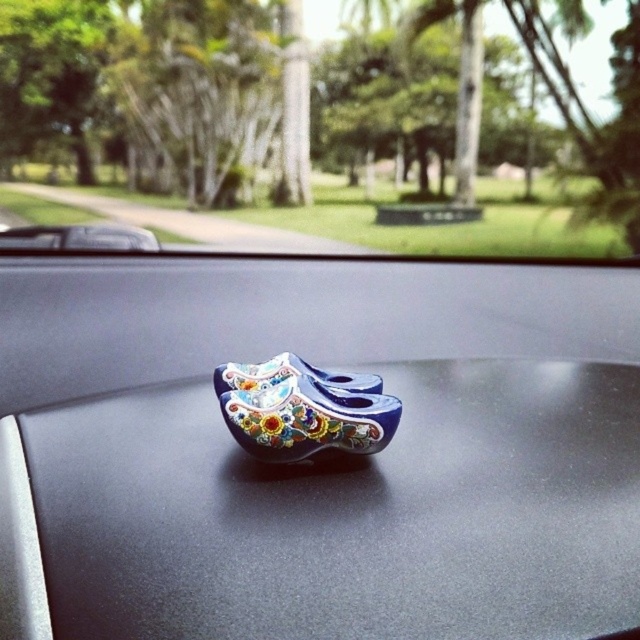
You are sitting in the driver seat of the car and see the point marked at coordinate (349, 513). Which object is that point located on?

The point marked at coordinate (349, 513) is located on the glossy ceramic clogs at center.

You are a passenger in the car and want to take a photo of the blue glossy wooden shoes at center through the transparent glass car window at center. Can you do this without moving either object?

The transparent glass car window at center is positioned on the right side of blue glossy wooden shoes at center, so you can take the photo without moving either object as the window is already aligned to the side of the shoes.

You are a passenger in the vehicle and want to place a small keychain between the glossy ceramic clogs at center and the blue glossy wooden shoes at center. Can you do this without moving either object?

The glossy ceramic clogs at center is closer to the viewer than the blue glossy wooden shoes at center, so you can place the keychain between them by positioning it in front of the blue glossy wooden shoes at center and behind the glossy ceramic clogs at center.